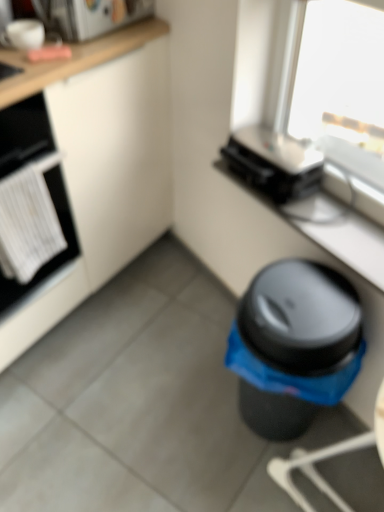
Question: In terms of height, does white matte cabinet at lower left look taller or shorter compared to white matte oven at left?

Choices:
 (A) tall
 (B) short

Answer: (A)

Question: Is white matte cabinet at lower left to the left or to the right of white matte oven at left in the image?

Choices:
 (A) right
 (B) left

Answer: (A)

Question: Based on their relative distances, which object is farther from the white matte oven at left?

Choices:
 (A) black plastic waste bin at lower right
 (B) white glossy microwave at upper left, which is the first appliance in left-to-right order
 (C) black plastic toaster at upper center, which ranks as the 2th appliance in left-to-right order
 (D) matte black toaster at upper right
 (E) white matte cabinet at lower left

Answer: (A)

Question: Estimate the real-world distances between objects in this image. Which object is closer to the white matte cabinet at lower left?

Choices:
 (A) white glossy microwave at upper left, positioned as the first appliance in top-to-bottom order
 (B) black plastic toaster at upper center, which ranks as the 2th appliance in left-to-right order
 (C) matte black toaster at upper right
 (D) black plastic waste bin at lower right
 (E) white matte oven at left

Answer: (E)